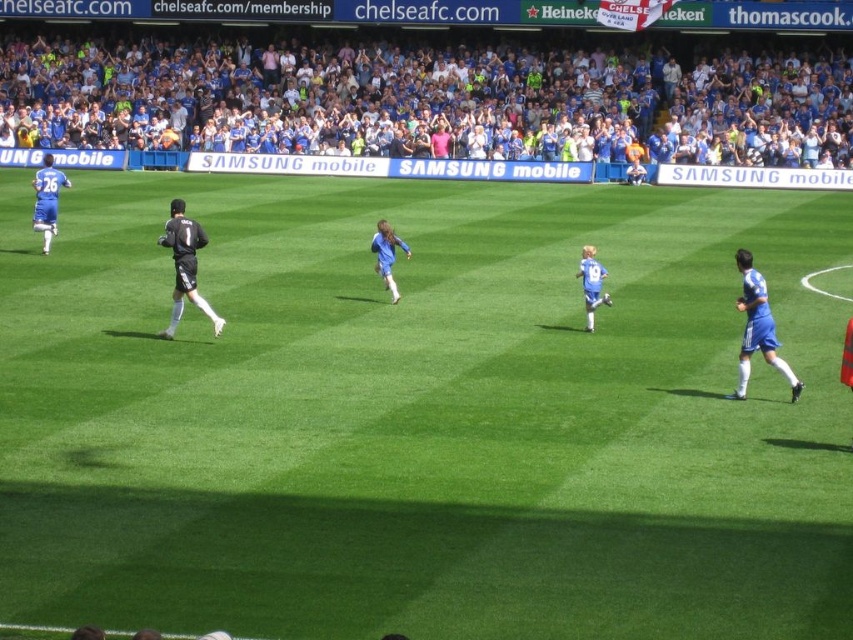
You are a photographer at the Chelsea FC stadium. You need to capture a photo that includes both the blue fabric crowd at upper center and the blue jersey at right. Which object should you adjust your camera angle to focus on first to ensure both are in frame?

The blue fabric crowd at upper center is taller than the blue jersey at right, so you should focus on the blue fabric crowd at upper center first to ensure both are in frame.